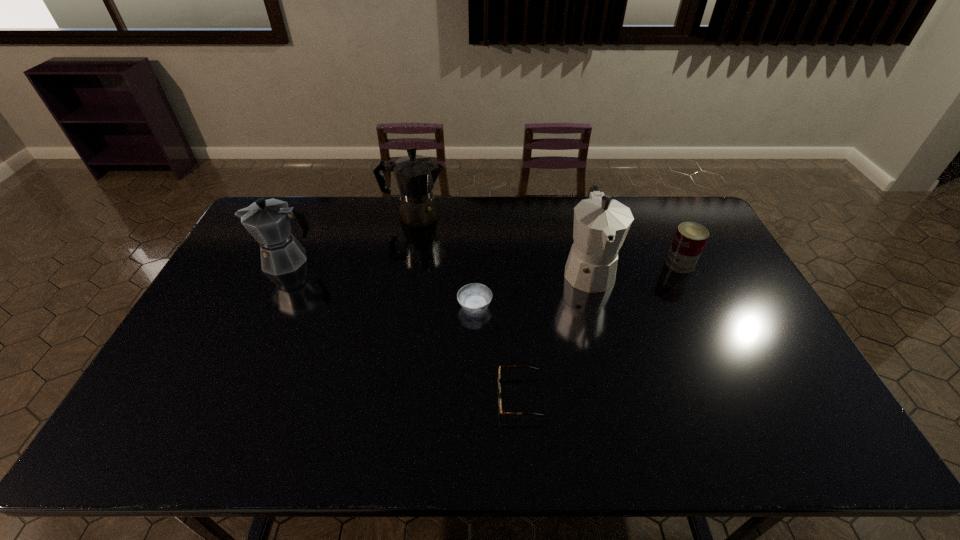
Image resolution: width=960 pixels, height=540 pixels. Find the location of `vacant space that satisfies the following two spatial constraints: 1. on the pouring side of the farthest coffeepot; 2. on the right side of the third object from left to right`. vacant space that satisfies the following two spatial constraints: 1. on the pouring side of the farthest coffeepot; 2. on the right side of the third object from left to right is located at coordinates (398, 306).

Image resolution: width=960 pixels, height=540 pixels. I want to click on free spot that satisfies the following two spatial constraints: 1. on the front label of the fourth tallest object; 2. at the spout of the fifth object from left to right, so click(x=683, y=269).

In order to click on vacant point that satisfies the following two spatial constraints: 1. on the pouring side of the third object from left to right; 2. on the left side of the farthest object in this screenshot , I will do `click(398, 306)`.

This screenshot has height=540, width=960. I want to click on free point that satisfies the following two spatial constraints: 1. at the spout of the fourth shortest object; 2. on the right side of the ashtray, so click(x=266, y=306).